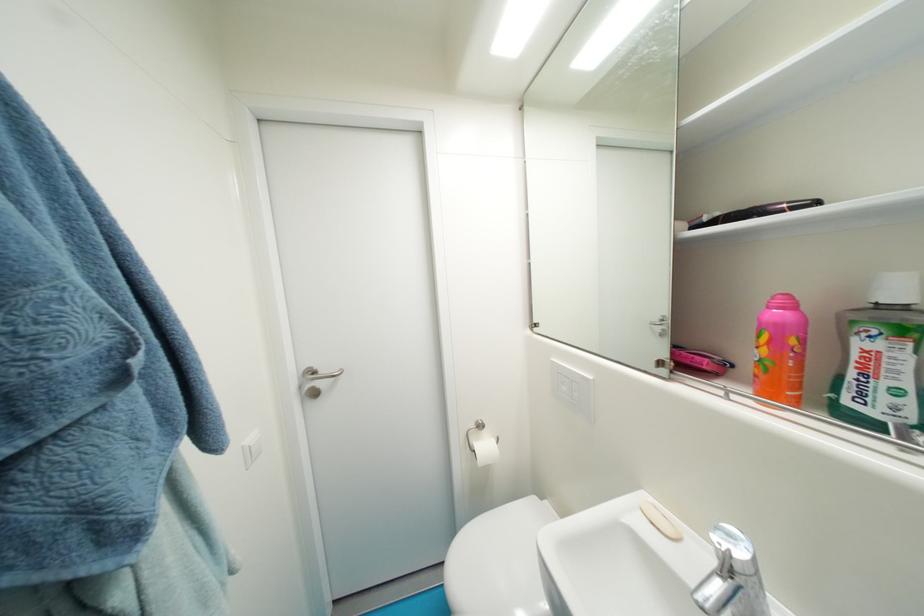
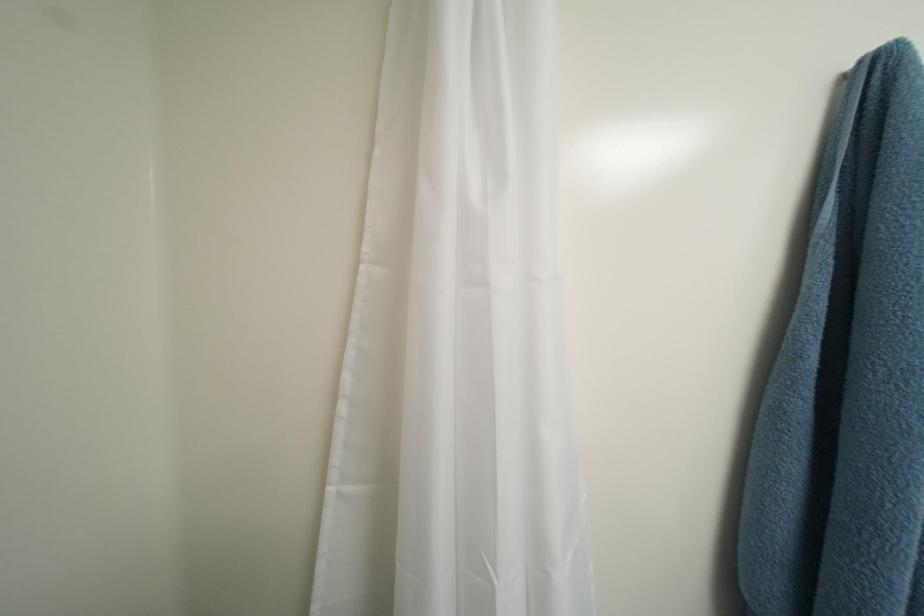
Question: The first image is from the beginning of the video and the second image is from the end. How did the camera likely rotate when shooting the video?

Choices:
 (A) Left
 (B) Right
 (C) Up
 (D) Down

Answer: (A)